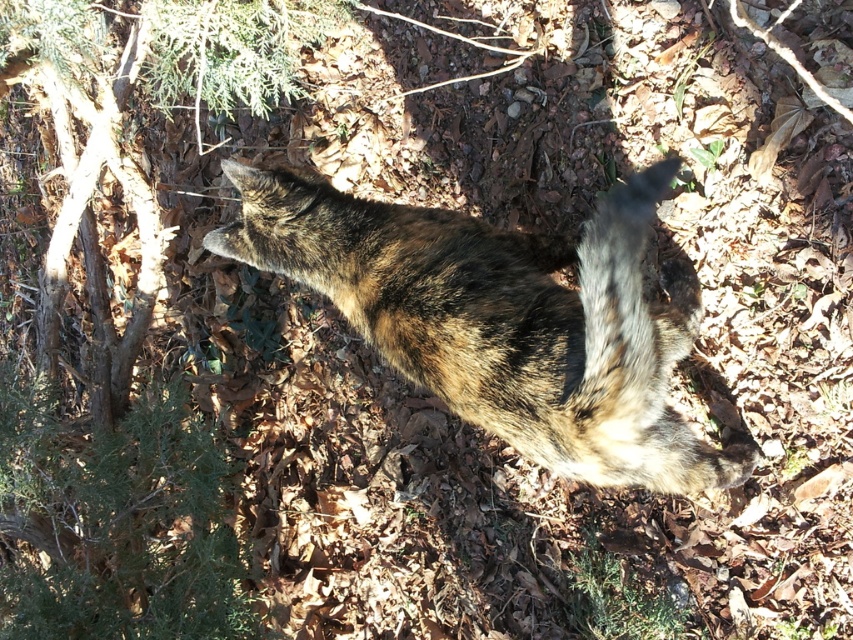
Which is more to the left, tabby fur cat at center or brown fur tail at center?

tabby fur cat at center is more to the left.

Identify the location of tabby fur cat at center. pos(503,320).

Between point (74, 534) and point (596, 348), which one is positioned behind?

The point (74, 534) is more distant.

How much distance is there between green textured tree at upper left and tabby fur cat at center?

The distance of green textured tree at upper left from tabby fur cat at center is 38.78 inches.

Locate an element on the screen. This screenshot has width=853, height=640. green textured tree at upper left is located at coordinates (114, 528).

The height and width of the screenshot is (640, 853). In order to click on green textured tree at upper left in this screenshot , I will do `click(114, 528)`.

Can you confirm if green textured tree at upper left is positioned below brown fur tail at center?

Actually, green textured tree at upper left is above brown fur tail at center.

Is green textured tree at upper left further to the viewer compared to brown fur tail at center?

Yes, green textured tree at upper left is behind brown fur tail at center.

Between point (35, 545) and point (578, 404), which one is positioned in front?

Point (578, 404)

Identify the location of green textured tree at upper left. (114, 528).